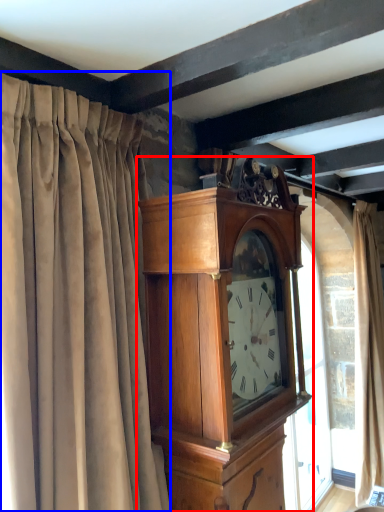
Question: Which object is closer to the camera taking this photo, wall clock (highlighted by a red box) or curtain (highlighted by a blue box)?

Choices:
 (A) wall clock
 (B) curtain

Answer: (B)